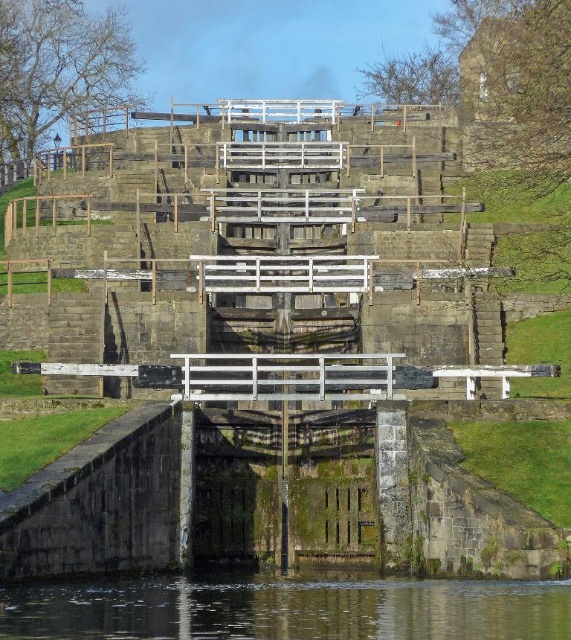
You are a maintenance worker needing to access the clear water at bottom for inspection. The weathered stone stairs at center are your only pathway. Are the stairs positioned in a way that allows you to reach the water safely?

The weathered stone stairs at center are to the left of clear water at bottom, so you can safely walk down the stairs to reach the water on their right side.